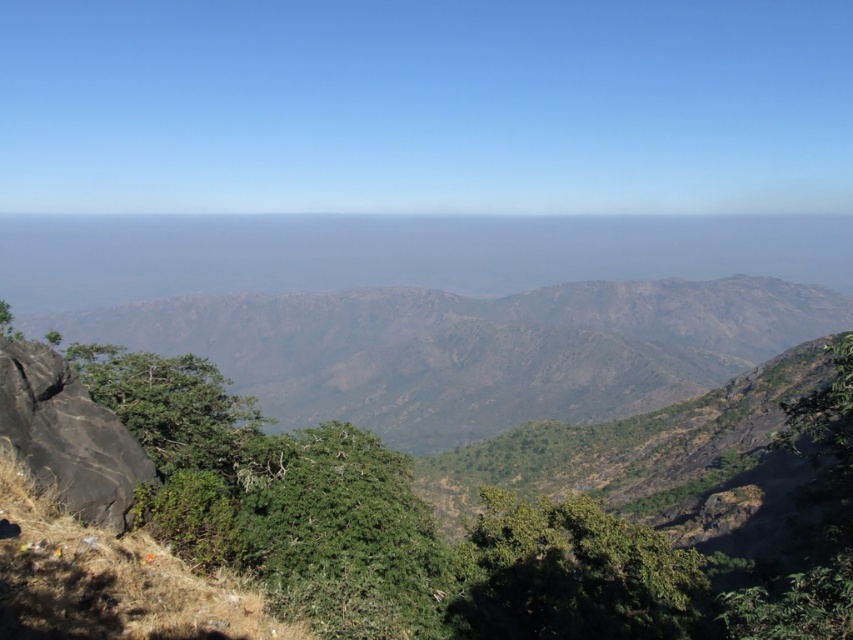
You are standing at the viewpoint in the mountain landscape. You see two points marked on the terrain. One is labeled as point (398, 356) and the other as point (10, 432). If you want to reach the point that is farther away from you, which one should you head towards?

You should head towards point (398, 356) because it is behind point (10, 432), meaning it is farther away from your current position.

You are a hiker planning to take a photo of the brown rocky mountain at left and the black rock at left. Which object should you move closer to in order to capture both in a single frame without zooming in?

To capture both the brown rocky mountain at left and the black rock at left in a single frame without zooming in, you should move closer to the brown rocky mountain at left since it is larger and will remain visible even when closer, allowing the smaller black rock at left to fit into the frame as well.

You are planning to hike across the rugged terrain in the foreground. You need to decide whether the brown rocky mountain at left or the black rock at left is wider to choose the best path. Which one has a greater width?

The brown rocky mountain at left has a greater width than the black rock at left according to the description.